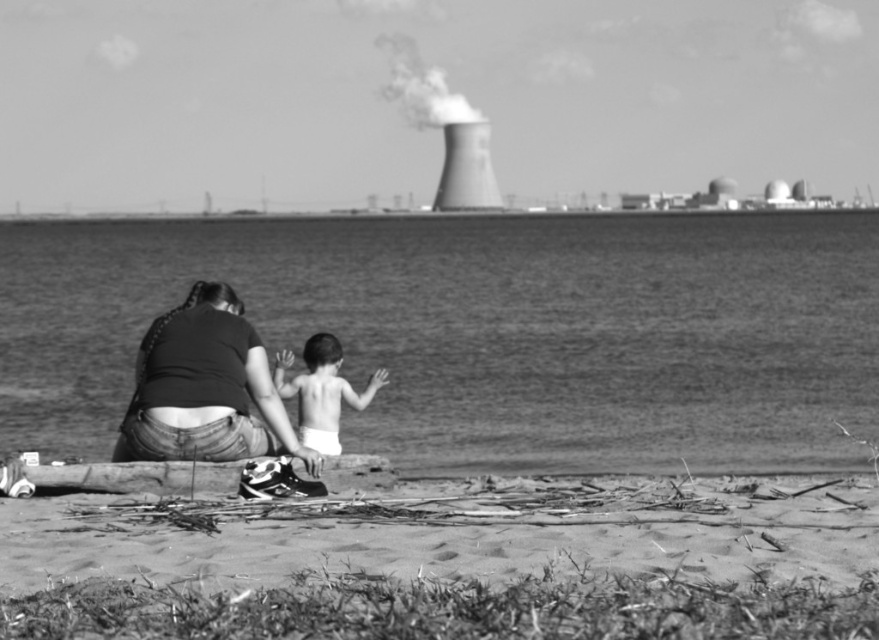
You are a photographer trying to capture the scene from the same angle. If you want to ensure both the smooth water at lower center and the denim jeans at lower left are visible in your frame, which object should you focus on first to maintain clarity?

The smooth water at lower center has a greater height compared to denim jeans at lower left, so focusing on the smooth water at lower center first will ensure both are in focus as it occupies more vertical space in the frame.

You are standing at the point with coordinates point (365, 396) and want to walk towards the point (191, 301). Based on the scene description, will you be walking towards the foreground or background of the image?

Point (191, 301) is in front of point (365, 396). Therefore, walking towards point (191, 301) means you are moving towards the foreground of the image.